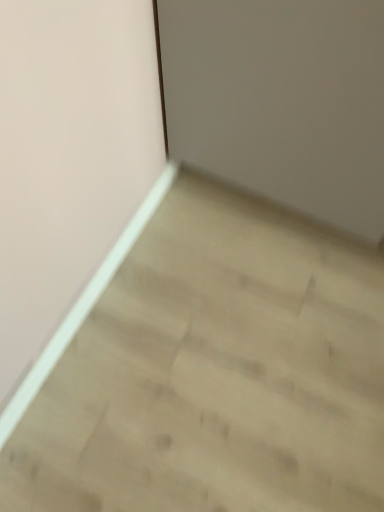
The image size is (384, 512). Identify the location of vacant region above light wood plank at center (from a real-world perspective). coord(233,344).